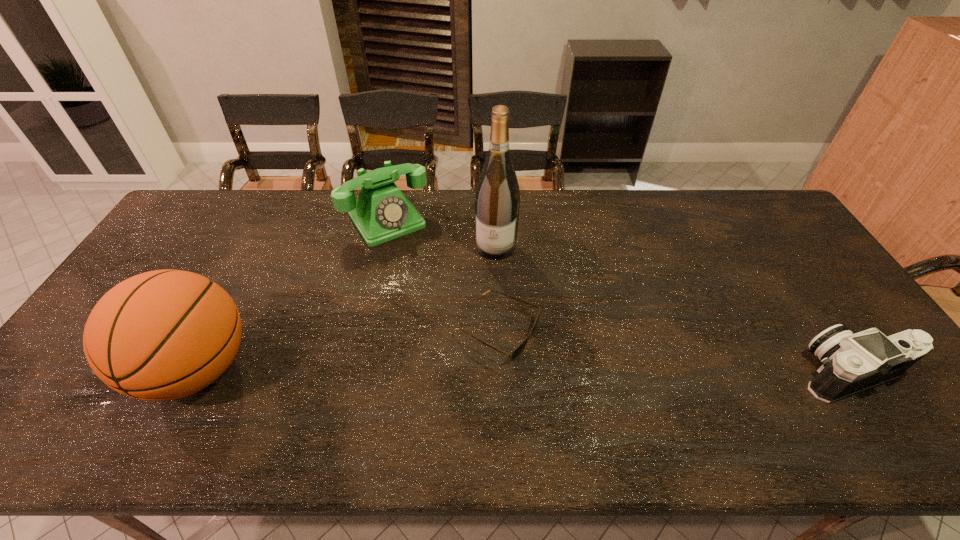
You are a GUI agent. You are given a task and a screenshot of the screen. Output one action in this format:
    pyautogui.click(x=<x>, y=<y>)
    Task: Click on the free spot located on the label of the wine bottle
    This screenshot has width=960, height=540.
    Given the screenshot: What is the action you would take?
    pyautogui.click(x=482, y=310)

Locate an element on the screen. The image size is (960, 540). vacant space located 0.380m on the label of the wine bottle is located at coordinates (470, 364).

I want to click on vacant space located on the label of the wine bottle, so click(x=473, y=352).

What are the coordinates of `free space located on the dial of the third shortest object` in the screenshot? It's located at (439, 292).

Identify the location of vacant space situated 0.090m on the dial of the third shortest object. The width and height of the screenshot is (960, 540). (416, 259).

Where is `free space located on the dial of the third shortest object`? This screenshot has width=960, height=540. free space located on the dial of the third shortest object is located at coordinates (463, 325).

Find the location of a particular element. Image resolution: width=960 pixels, height=540 pixels. vacant space situated on the lenses of the sunglasses is located at coordinates (614, 386).

Identify the location of free space located on the lenses of the sunglasses. The height and width of the screenshot is (540, 960). (652, 403).

Identify the location of vacant position located 0.150m on the lenses of the sunglasses. This screenshot has height=540, width=960. (591, 375).

The height and width of the screenshot is (540, 960). I want to click on object situated at the far edge, so click(x=381, y=212).